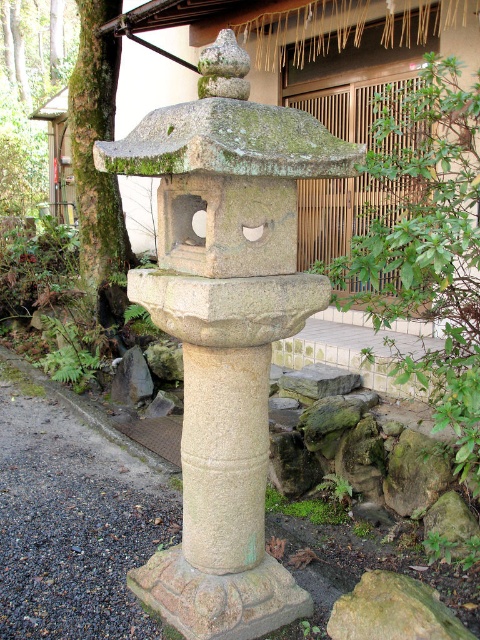
You are standing at the entrance of the garden and want to find the green stone lantern at center. According to the coordinates provided, where should you look to find it?

The green stone lantern at center is located at coordinates point [226,326].

You are a gardener planning to place a new decorative rock next to the green mossy bark at left without blocking the view of the green stone lantern at center. Based on their widths, which object should you consider the spacing around?

The green stone lantern at center might be wider than green mossy bark at left, so you should consider spacing around the green stone lantern at center to ensure the new rock doesn

Looking at this image, you are standing on the gravel path near the traditional Japanese stone lantern. You notice two points marked on the ground. The first point is at coordinate point[210,333] and the second point is at coordinate point[96,276]. Which point is closer to you?

Point[210,333] is closer to you than point[96,276].